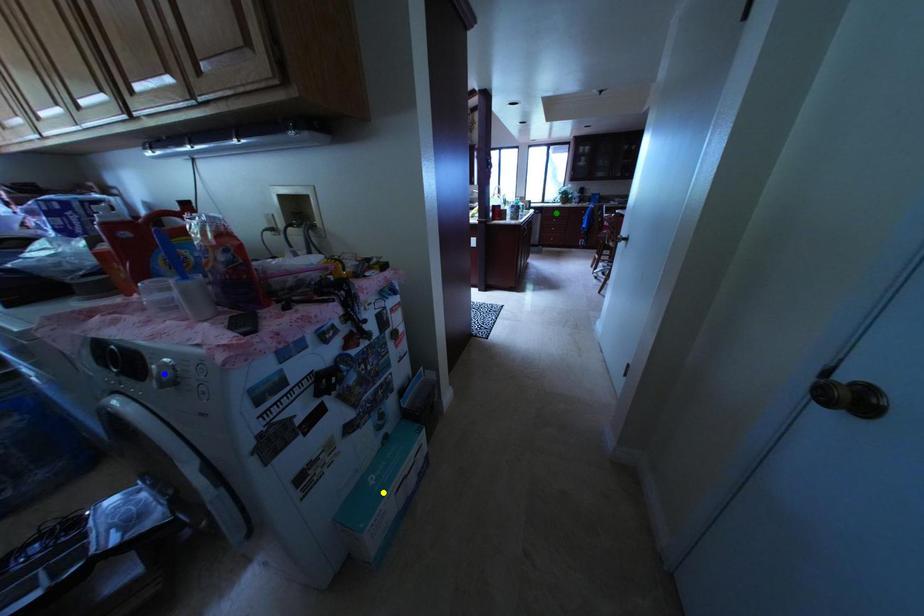
Looking at this image, order these from farthest to nearest:
1. yellow point
2. green point
3. blue point

green point, yellow point, blue point